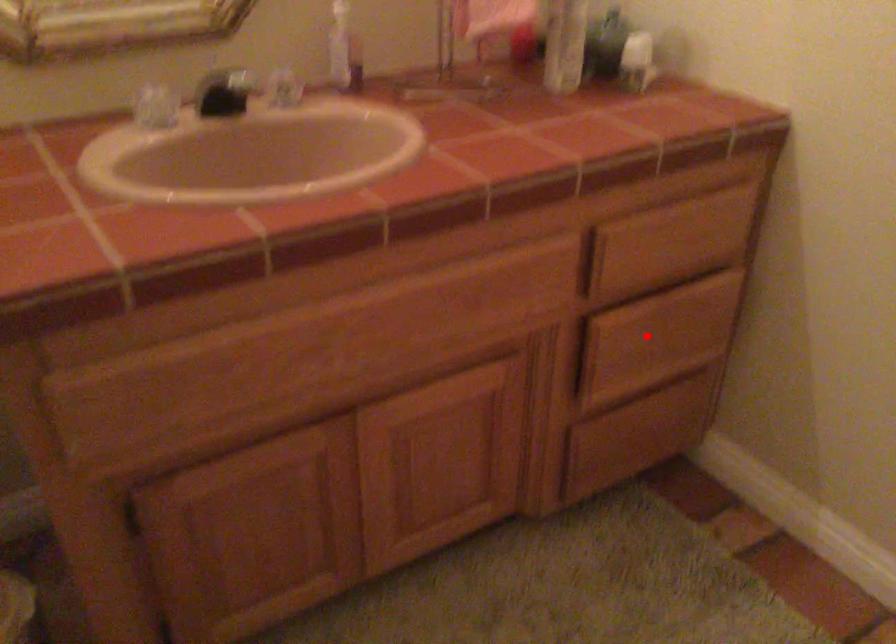
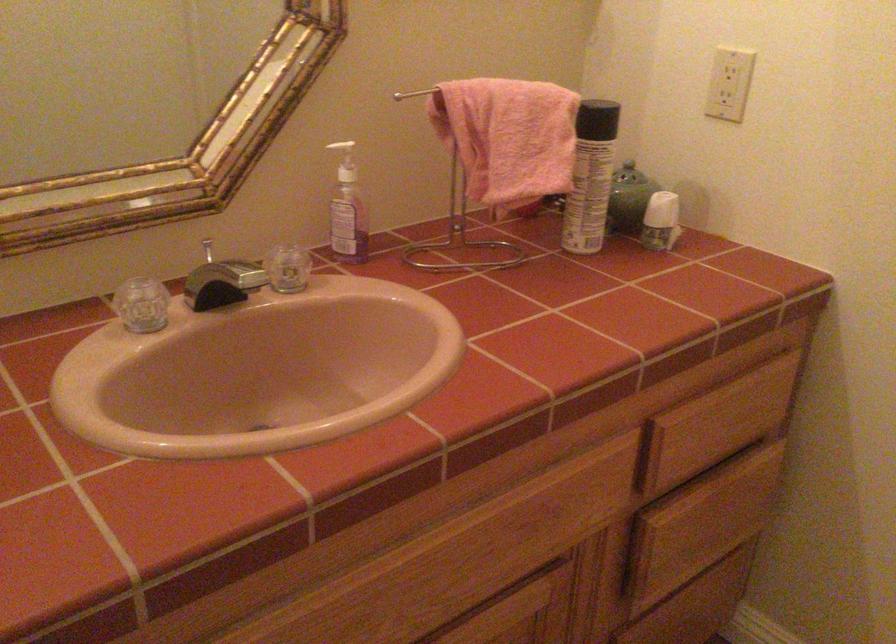
In the second image, find the point that corresponds to the highlighted location in the first image.

(701, 524)